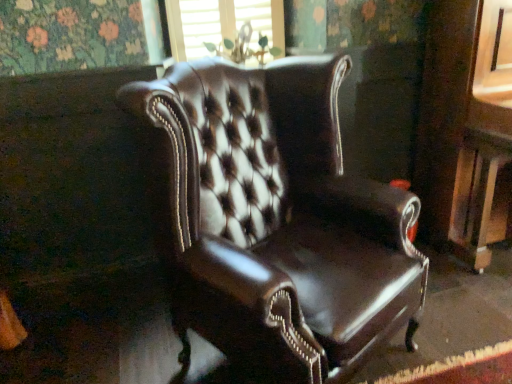
In order to face wooden window frame at upper center, should I rotate leftwards or rightwards?

Turn left approximately 3.696 degrees to face it.

What do you see at coordinates (220, 23) in the screenshot? The image size is (512, 384). I see `wooden window frame at upper center` at bounding box center [220, 23].

Find the location of `wooden window frame at upper center`. wooden window frame at upper center is located at coordinates (220, 23).

Measure the distance between wooden window frame at upper center and camera.

wooden window frame at upper center is 6.08 feet from camera.

Describe the element at coordinates (278, 219) in the screenshot. I see `shiny brown leather chair at center` at that location.

Image resolution: width=512 pixels, height=384 pixels. I want to click on shiny brown leather chair at center, so click(x=278, y=219).

Image resolution: width=512 pixels, height=384 pixels. What are the coordinates of `wooden window frame at upper center` in the screenshot? It's located at (220, 23).

Looking at this image, is wooden window frame at upper center at the left side of shiny brown leather chair at center?

Yes, wooden window frame at upper center is to the left of shiny brown leather chair at center.

Does wooden window frame at upper center lie in front of shiny brown leather chair at center?

No.

Is point (254, 18) behind point (370, 196)?

That is True.

From the image's perspective, between wooden window frame at upper center and shiny brown leather chair at center, who is located below?

From the image's view, shiny brown leather chair at center is below.

From a real-world perspective, is wooden window frame at upper center above or below shiny brown leather chair at center?

In terms of real-world spatial position, wooden window frame at upper center is above shiny brown leather chair at center.

Considering the sizes of wooden window frame at upper center and shiny brown leather chair at center in the image, is wooden window frame at upper center wider or thinner than shiny brown leather chair at center?

In the image, wooden window frame at upper center appears to be more narrow than shiny brown leather chair at center.

Does wooden window frame at upper center have a greater height compared to shiny brown leather chair at center?

In fact, wooden window frame at upper center may be shorter than shiny brown leather chair at center.

Looking at the image, does wooden window frame at upper center seem bigger or smaller compared to shiny brown leather chair at center?

Clearly, wooden window frame at upper center is smaller in size than shiny brown leather chair at center.

Could shiny brown leather chair at center be considered to be inside wooden window frame at upper center?

That's incorrect, shiny brown leather chair at center is not inside wooden window frame at upper center.

Does wooden window frame at upper center touch shiny brown leather chair at center?

Answer: They are not placed beside each other.

Is wooden window frame at upper center facing towards shiny brown leather chair at center?

No.

Find the location of a particular element. This screenshot has width=512, height=384. window frame behind the shiny brown leather chair at center is located at coordinates (220, 23).

Based on their positions, is shiny brown leather chair at center located to the left or right of wooden window frame at upper center?

In the image, shiny brown leather chair at center appears on the right side of wooden window frame at upper center.

Between shiny brown leather chair at center and wooden window frame at upper center, which one is positioned behind?

wooden window frame at upper center is behind.

Which is behind, point (348, 301) or point (200, 37)?

The point (200, 37) is behind.

From the image's perspective, is shiny brown leather chair at center located above wooden window frame at upper center?

No, from the image's perspective, shiny brown leather chair at center is not over wooden window frame at upper center.

In the scene shown: From a real-world perspective, which object stands above the other?

In real-world perspective, wooden window frame at upper center is above.

Which of these two, shiny brown leather chair at center or wooden window frame at upper center, is wider?

Wider between the two is shiny brown leather chair at center.

In terms of height, does shiny brown leather chair at center look taller or shorter compared to wooden window frame at upper center?

Clearly, shiny brown leather chair at center is taller compared to wooden window frame at upper center.

Between shiny brown leather chair at center and wooden window frame at upper center, which one has smaller size?

With smaller size is wooden window frame at upper center.

Is shiny brown leather chair at center not within wooden window frame at upper center?

That's correct, shiny brown leather chair at center is outside of wooden window frame at upper center.

Are shiny brown leather chair at center and wooden window frame at upper center located far from each other?

No, shiny brown leather chair at center is in close proximity to wooden window frame at upper center.

Could you tell me if shiny brown leather chair at center is facing wooden window frame at upper center?

No, shiny brown leather chair at center is not facing towards wooden window frame at upper center.

What's the angular difference between shiny brown leather chair at center and wooden window frame at upper center's facing directions?

The facing directions of shiny brown leather chair at center and wooden window frame at upper center are 28.1 degrees apart.

How much distance is there between shiny brown leather chair at center and wooden window frame at upper center?

shiny brown leather chair at center and wooden window frame at upper center are 88.32 centimeters apart.

At what (x,y) coordinates should I click in order to perform the action: click on chair in front of the wooden window frame at upper center. Please return your answer as a coordinate pair (x, y). Looking at the image, I should click on (278, 219).

At what (x,y) coordinates should I click in order to perform the action: click on chair that appears below the wooden window frame at upper center (from the image's perspective). Please return your answer as a coordinate pair (x, y). Looking at the image, I should click on (278, 219).

Where is `chair below the wooden window frame at upper center (from a real-world perspective)`? The width and height of the screenshot is (512, 384). chair below the wooden window frame at upper center (from a real-world perspective) is located at coordinates (278, 219).